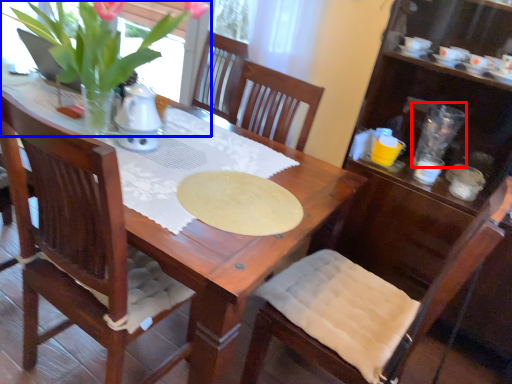
Question: Which object appears closest to the camera in this image, tableware (highlighted by a red box) or houseplant (highlighted by a blue box)?

Choices:
 (A) tableware
 (B) houseplant

Answer: (B)